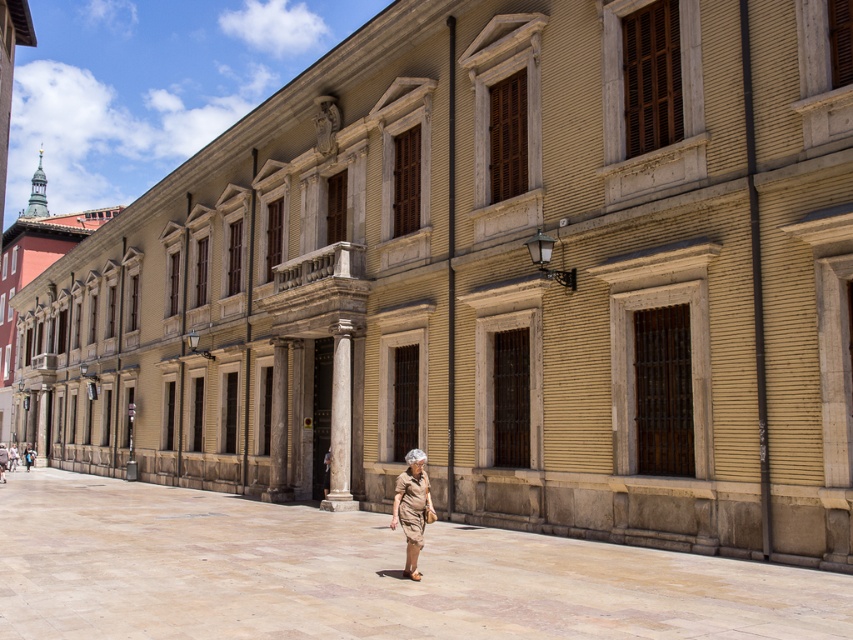
You are a photographer trying to capture both the brown fabric trench coat at lower center and the light brown leather jacket at center in the same frame. Since the trench coat is covering part of the jacket, how can you adjust your camera angle to ensure both are fully visible?

The brown fabric trench coat at lower center is positioned over the light brown leather jacket at center. To capture both fully, move your camera angle slightly downward to avoid the trench coat blocking the jacket.

You are a photographer trying to capture the person in the plaza. You want to focus on the khaki cotton shorts at center without the brown fabric trench coat at lower center blocking the view. Is this possible?

The brown fabric trench coat at lower center is positioned over khaki cotton shorts at center, so it will block the view of the khaki cotton shorts at center. You cannot capture the khaki cotton shorts at center without the trench coat obstructing it.